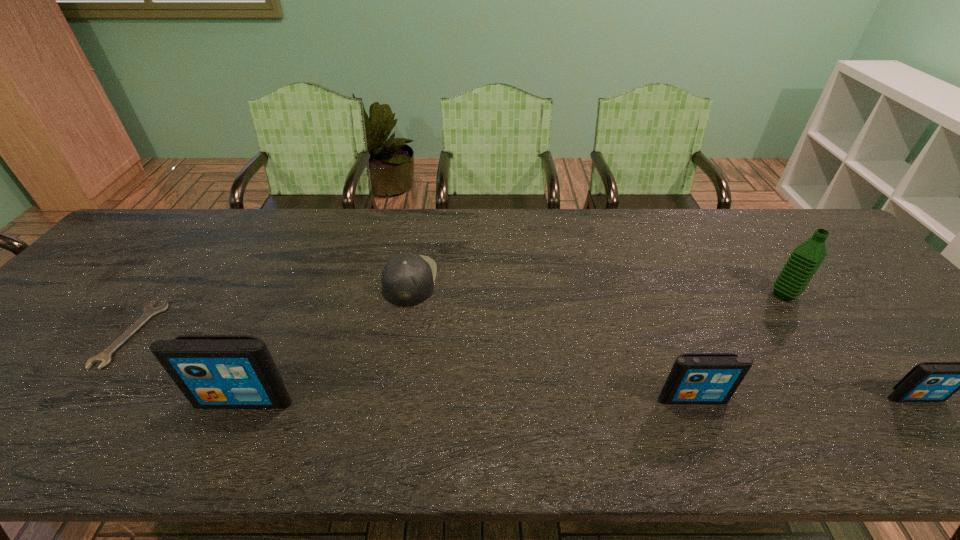
Where is `water bottle`? Image resolution: width=960 pixels, height=540 pixels. water bottle is located at coordinates (805, 259).

Locate an element on the screen. The height and width of the screenshot is (540, 960). free space located 0.250m on the back of the wrench is located at coordinates (200, 245).

At what (x,y) coordinates should I click in order to perform the action: click on free space located on the brim of the fourth object from right to left. Please return your answer as a coordinate pair (x, y). This screenshot has width=960, height=540. Looking at the image, I should click on (486, 280).

In order to click on free location located on the back of the water bottle in this screenshot , I will do `click(728, 217)`.

Locate an element on the screen. object at the right edge is located at coordinates (929, 381).

Find the location of a particular element. The image size is (960, 540). object located in the near right corner section of the desktop is located at coordinates (929, 381).

Where is `free space at the far edge of the desktop`? free space at the far edge of the desktop is located at coordinates (446, 211).

The image size is (960, 540). In order to click on free spot at the near edge of the desktop in this screenshot , I will do `click(603, 401)`.

You are a GUI agent. You are given a task and a screenshot of the screen. Output one action in this format:
    pyautogui.click(x=<x>, y=<y>)
    Task: Click on the vacant space at the near left corner of the desktop
    The height and width of the screenshot is (540, 960).
    Given the screenshot: What is the action you would take?
    pyautogui.click(x=37, y=394)

Identify the location of free space between the second object from right to left and the fourth object from left to right. (738, 346).